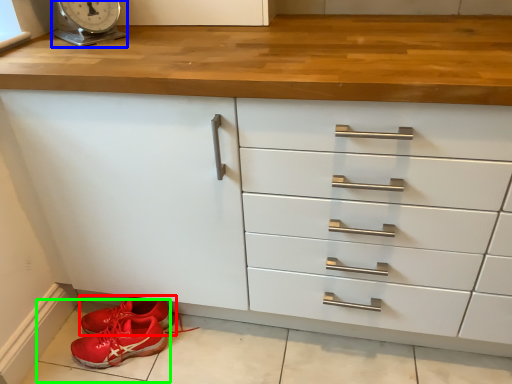
Question: Based on their relative distances, which object is farther from footwear (highlighted by a red box)? Choose from scale (highlighted by a blue box) and tile (highlighted by a green box).

Choices:
 (A) scale
 (B) tile

Answer: (A)